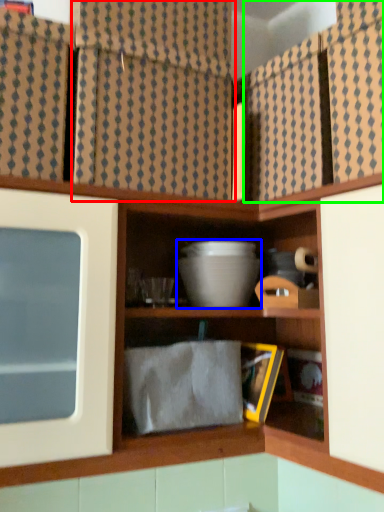
Question: Considering the real-world distances, which object is farthest from curtain (highlighted by a red box)? mixing bowl (highlighted by a blue box) or cabinet (highlighted by a green box)?

Choices:
 (A) mixing bowl
 (B) cabinet

Answer: (A)